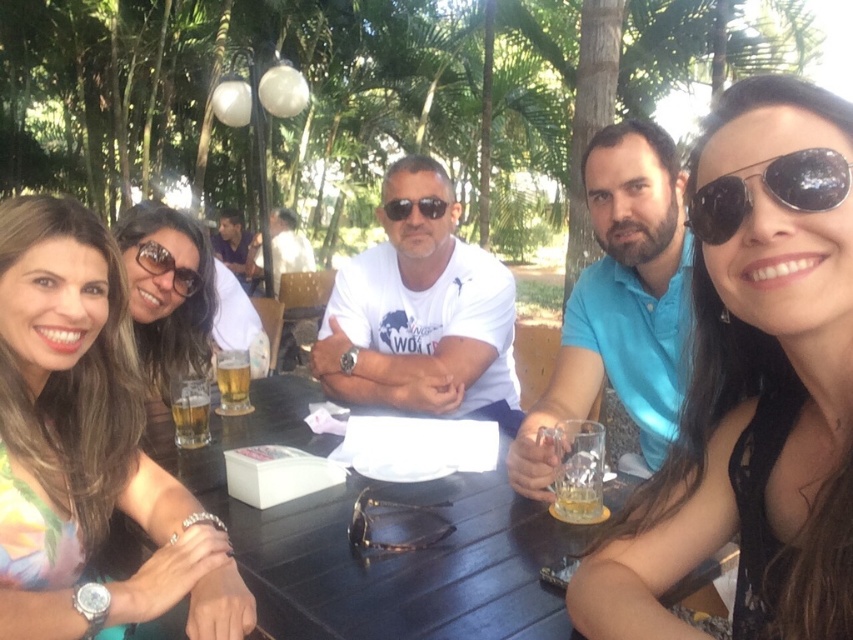
You are standing in the park and want to take a photo of the group at the wooden table. The camera you have can only focus on objects within 1.2 meters. Is the point at coordinates point (80,273) within the camera focus range?

The point point (80,273) is 1.19 meters from viewer, so yes, it is within the camera focus range of 1.2 meters.

You are a photographer at the park and want to take a photo of the floral fabric dress at lower left and the translucent glass beer at table center. Which object is positioned to the right of the other?

The floral fabric dress at lower left is to the right of the translucent glass beer at table center according to the description.

You are standing at the point with coordinates (375, 557) in the image. What object are you standing on?

You are standing on the black wood table at center.